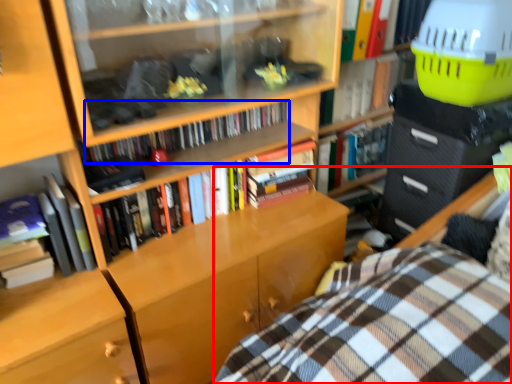
Question: Which of the following is the farthest to the observer, bed (highlighted by a red box) or book (highlighted by a blue box)?

Choices:
 (A) bed
 (B) book

Answer: (B)